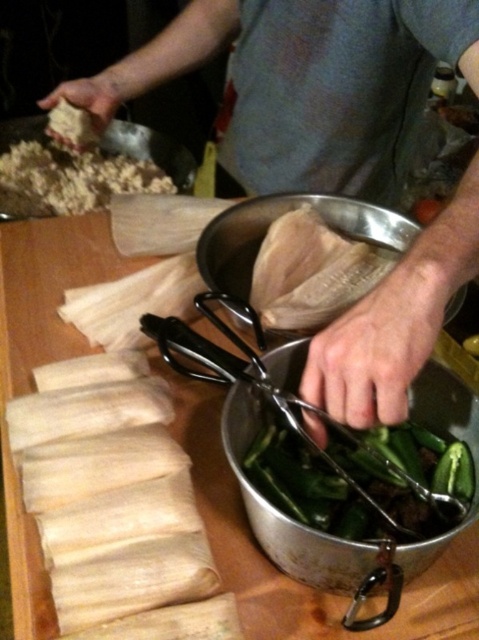
Can you confirm if smooth beige tortilla at center is positioned above white paper at center?

Correct, smooth beige tortilla at center is located above white paper at center.

The image size is (479, 640). Identify the location of smooth beige tortilla at center. tap(306, 81).

Is point (353, 403) positioned after point (363, 280)?

No, it is not.

Where is `smooth beige tortilla at center`? The height and width of the screenshot is (640, 479). smooth beige tortilla at center is located at coordinates (306, 81).

Can you confirm if black metal tongs at center is taller than brown crumbly at upper left?

Yes, black metal tongs at center is taller than brown crumbly at upper left.

Based on the photo, which is more to the right, black metal tongs at center or brown crumbly at upper left?

black metal tongs at center

Between point (296, 497) and point (12, 186), which one is positioned behind?

The point (12, 186) is behind.

Where is `black metal tongs at center`? The width and height of the screenshot is (479, 640). black metal tongs at center is located at coordinates (317, 445).

Is black metal tongs at center further to the viewer compared to white paper at center?

No.

Is the position of black metal tongs at center less distant than that of white paper at center?

Yes, it is in front of white paper at center.

Does point (384, 484) lie in front of point (301, 260)?

Yes, it is in front of point (301, 260).

Find the location of `black metal tongs at center`. black metal tongs at center is located at coordinates (317, 445).